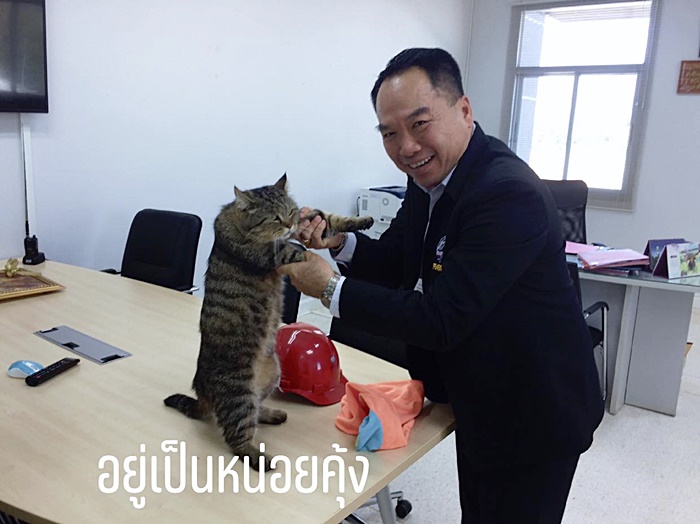
Identify the location of chair. This screenshot has height=524, width=700. (155, 231).